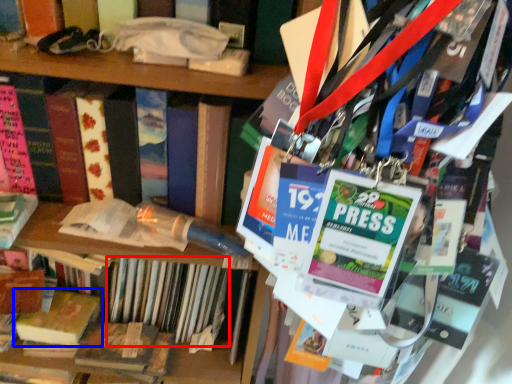
Question: Which point is further to the camera, book (highlighted by a red box) or book (highlighted by a blue box)?

Choices:
 (A) book
 (B) book

Answer: (B)